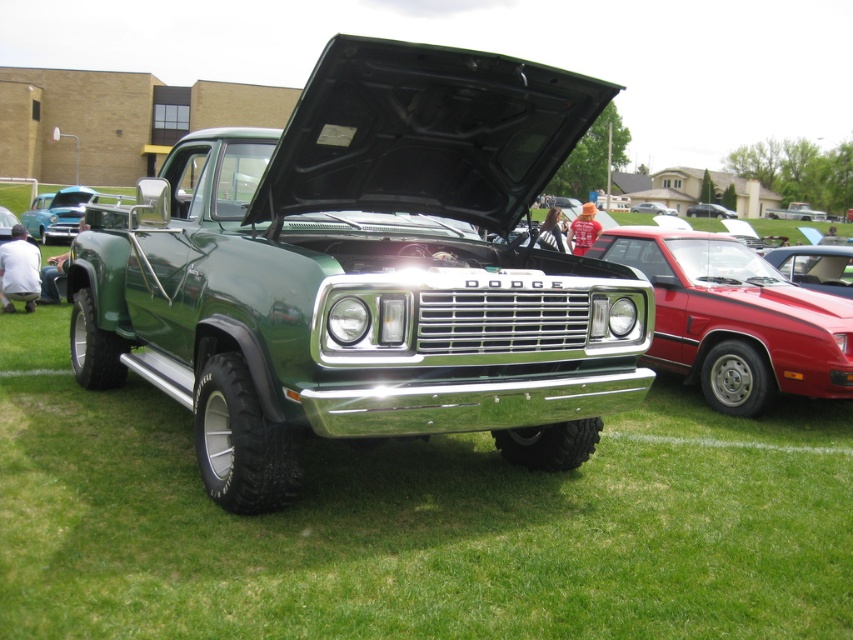
Question: Which object is farther from the camera taking this photo?

Choices:
 (A) teal glossy sedan at center
 (B) metallic silver sedan at center

Answer: (B)

Question: Can you confirm if shiny red car at center is positioned above metallic silver sedan at center?

Choices:
 (A) yes
 (B) no

Answer: (B)

Question: Which point is closer to the camera?

Choices:
 (A) teal glossy sedan at center
 (B) metallic silver sedan at center

Answer: (A)

Question: Is shiny red car at center positioned at the back of teal glossy sedan at center?

Choices:
 (A) no
 (B) yes

Answer: (A)

Question: Considering the real-world distances, which object is farthest from the shiny red car at center?

Choices:
 (A) metallic silver sedan at center
 (B) teal glossy sedan at center

Answer: (A)

Question: Does teal glossy sedan at center have a greater width compared to metallic silver sedan at center?

Choices:
 (A) yes
 (B) no

Answer: (A)